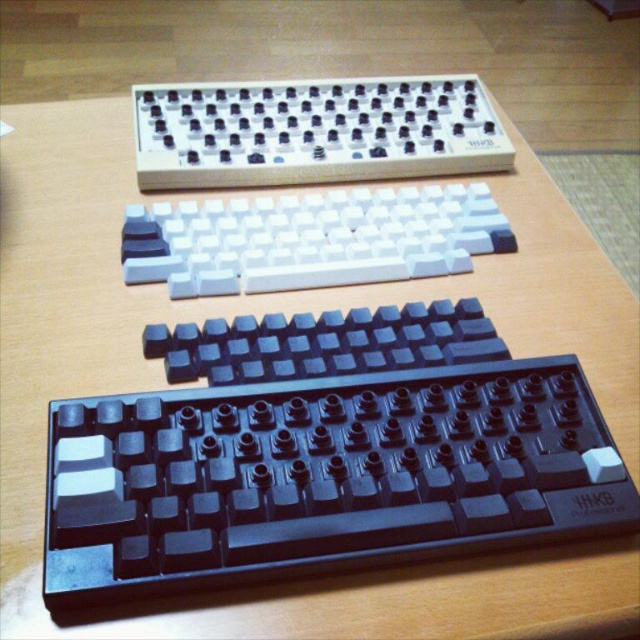
Question: Is white matte keyboard at upper center smaller than white matte keyboard at center?

Choices:
 (A) no
 (B) yes

Answer: (A)

Question: Which point is closer to the camera?

Choices:
 (A) (168, 253)
 (B) (552, 445)
 (C) (426, 90)

Answer: (B)

Question: Is black matte keyboard at bottom to the left of white matte keyboard at upper center from the viewer's perspective?

Choices:
 (A) no
 (B) yes

Answer: (A)

Question: Is white matte keyboard at upper center bigger than white matte keyboard at center?

Choices:
 (A) no
 (B) yes

Answer: (B)

Question: Estimate the real-world distances between objects in this image. Which object is farther from the white matte keyboard at center?

Choices:
 (A) black matte keyboard at bottom
 (B) white matte keyboard at upper center

Answer: (A)

Question: Which is farther from the white matte keyboard at center?

Choices:
 (A) white matte keyboard at upper center
 (B) black matte keyboard at bottom

Answer: (B)